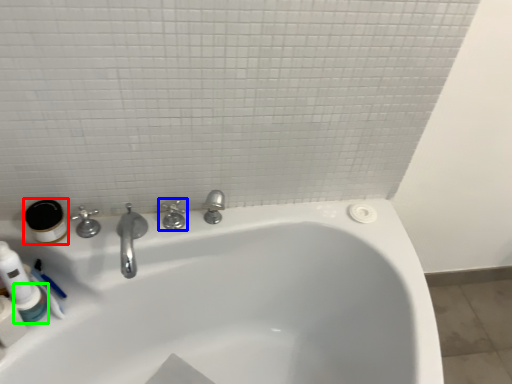
Question: Estimate the real-world distances between objects in this image. Which object is farther from mouthwash (highlighted by a red box), tap (highlighted by a blue box) or mouthwash (highlighted by a green box)?

Choices:
 (A) tap
 (B) mouthwash

Answer: (A)